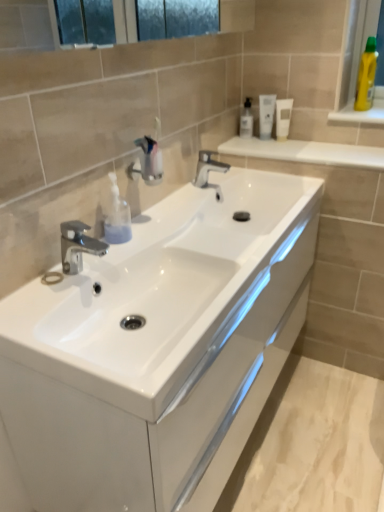
At what (x,y) coordinates should I click in order to perform the action: click on vacant region in front of translucent plastic soap dispenser at center, positioned as the second toiletry in back-to-front order. Please return your answer as a coordinate pair (x, y). Image resolution: width=384 pixels, height=512 pixels. Looking at the image, I should click on click(100, 264).